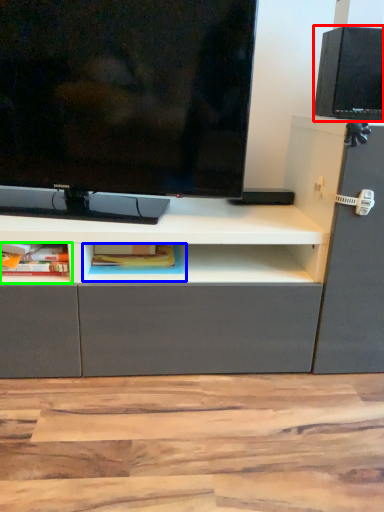
Question: Which object is positioned farthest from speaker (highlighted by a red box)? Select from cabinet (highlighted by a blue box) and cabinet (highlighted by a green box).

Choices:
 (A) cabinet
 (B) cabinet

Answer: (B)